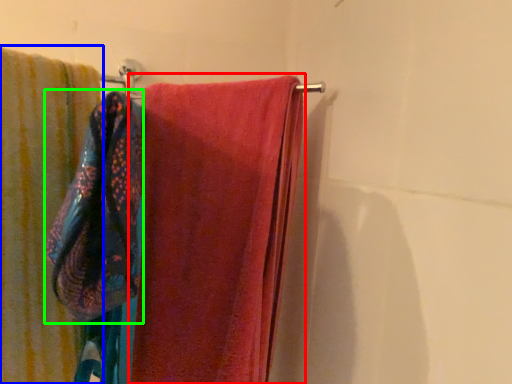
Question: Estimate the real-world distances between objects in this image. Which object is closer to towel (highlighted by a red box), towel (highlighted by a blue box) or beach towel (highlighted by a green box)?

Choices:
 (A) towel
 (B) beach towel

Answer: (A)